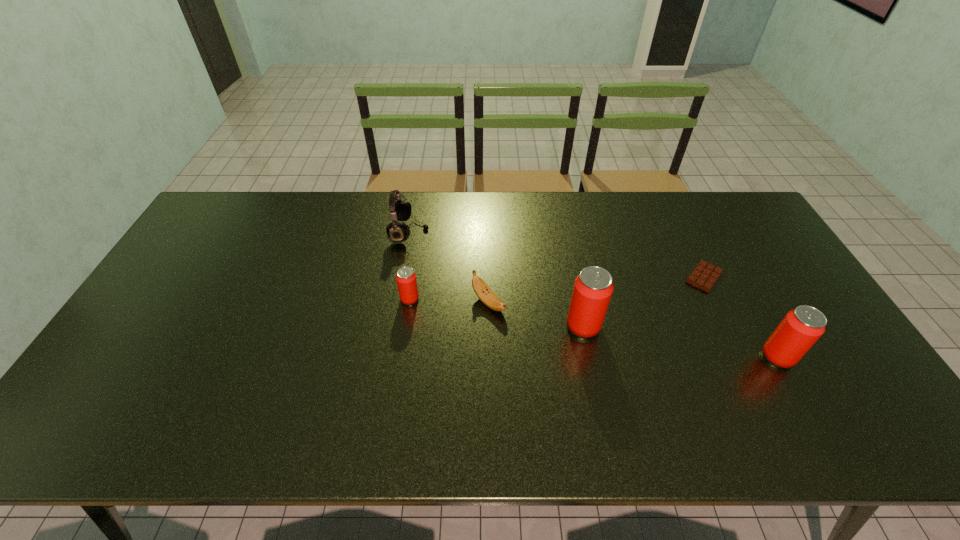
I want to click on empty location between the third object from right to left and the headset, so click(496, 279).

What are the coordinates of `empty location between the second beer can from left to right and the nearest object` in the screenshot? It's located at (681, 341).

At what (x,y) coordinates should I click in order to perform the action: click on free spot between the second beer can from right to left and the shortest beer can. Please return your answer as a coordinate pair (x, y). The width and height of the screenshot is (960, 540). Looking at the image, I should click on (496, 313).

Identify the location of the second closest object relative to the headset. The height and width of the screenshot is (540, 960). [484, 293].

Image resolution: width=960 pixels, height=540 pixels. Identify the location of the fourth closest object relative to the second shortest beer can. (406, 278).

At what (x,y) coordinates should I click in order to perform the action: click on beer can that is the second closest to the farthest beer can. Please return your answer as a coordinate pair (x, y). Looking at the image, I should click on (799, 330).

You are a GUI agent. You are given a task and a screenshot of the screen. Output one action in this format:
    pyautogui.click(x=<x>, y=<y>)
    Task: Click on the beer can that can be found as the closest to the second shortest object
    The height and width of the screenshot is (540, 960).
    Given the screenshot: What is the action you would take?
    click(x=406, y=278)

Identify the location of vacant region that satisfies the following two spatial constraints: 1. on the front side of the leftmost beer can; 2. on the right side of the third object from right to left. (406, 326).

Identify the location of vacant space that satisfies the following two spatial constraints: 1. on the back side of the candy bar; 2. with the microphone on the side of the farthest object. (682, 232).

Find the location of a particular element. The width and height of the screenshot is (960, 540). vacant space that satisfies the following two spatial constraints: 1. with the microphone on the side of the fourth tallest object; 2. on the left side of the headset is located at coordinates (397, 299).